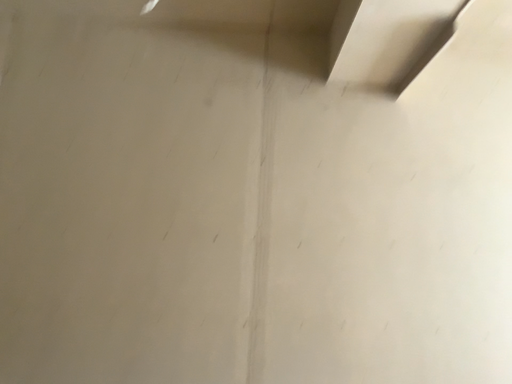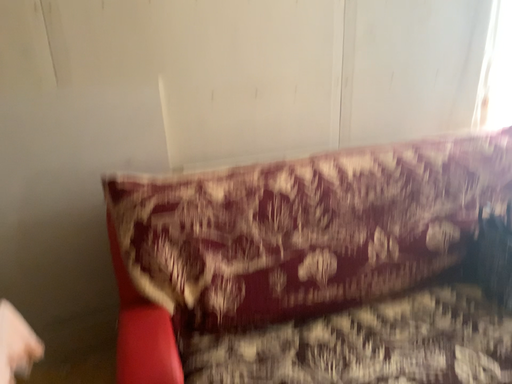
Question: How did the camera likely rotate when shooting the video?

Choices:
 (A) rotated upward
 (B) rotated downward

Answer: (B)